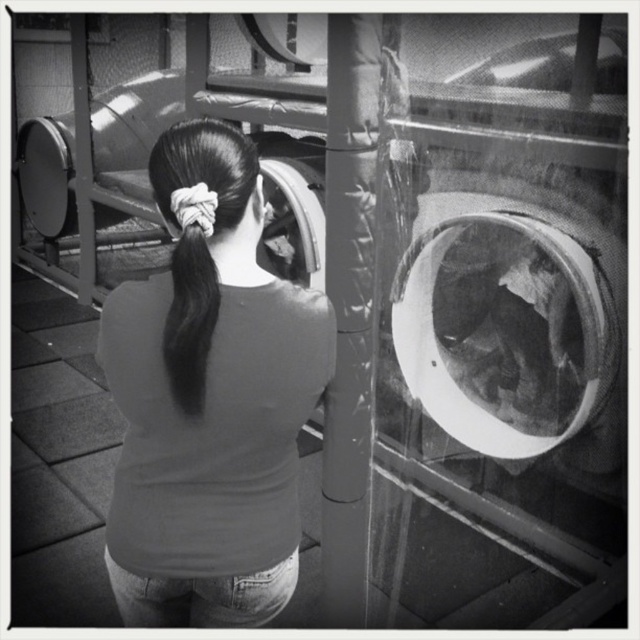
Question: Does smooth gray shirt at center come in front of black silky hair at center?

Choices:
 (A) yes
 (B) no

Answer: (B)

Question: Which object is positioned farthest from the black matte hair at center?

Choices:
 (A) smooth gray shirt at center
 (B) black silky hair at center

Answer: (A)

Question: Considering the relative positions of smooth gray shirt at center and black matte hair at center in the image provided, where is smooth gray shirt at center located with respect to black matte hair at center?

Choices:
 (A) below
 (B) above

Answer: (A)

Question: Which point is closer to the camera?

Choices:
 (A) smooth gray shirt at center
 (B) black matte hair at center

Answer: (B)

Question: Which object is the closest to the smooth gray shirt at center?

Choices:
 (A) black silky hair at center
 (B) black matte hair at center

Answer: (B)

Question: Can you confirm if black matte hair at center is smaller than black silky hair at center?

Choices:
 (A) yes
 (B) no

Answer: (B)